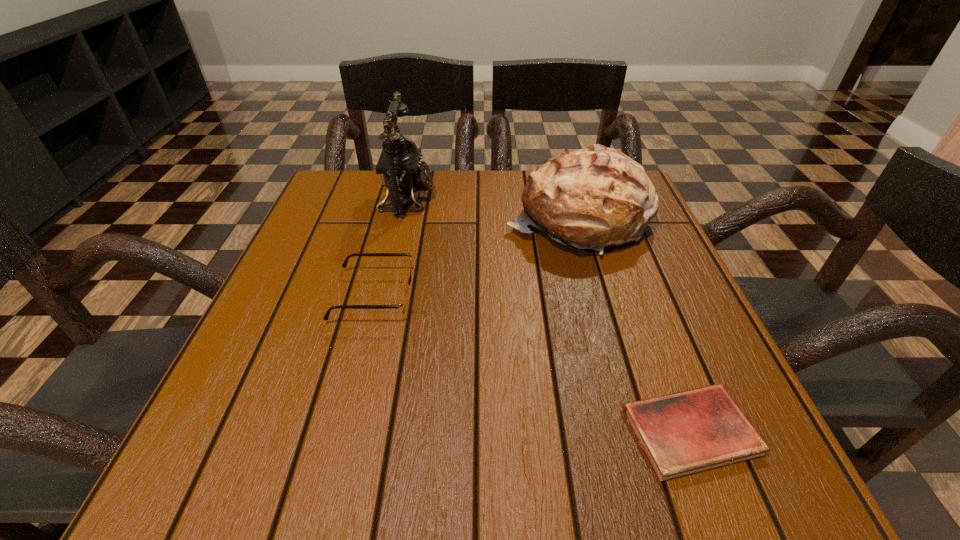
Where is `vacant space that satisfies the following two spatial constraints: 1. on the back side of the nearest object; 2. on the rotary dial of the telephone`? The width and height of the screenshot is (960, 540). vacant space that satisfies the following two spatial constraints: 1. on the back side of the nearest object; 2. on the rotary dial of the telephone is located at coordinates (602, 199).

I want to click on free location that satisfies the following two spatial constraints: 1. at the hinge ends of the third tallest object; 2. on the left side of the nearest object, so click(340, 431).

Locate an element on the screen. The width and height of the screenshot is (960, 540). free space that satisfies the following two spatial constraints: 1. at the hinge ends of the nearest object; 2. on the left side of the third tallest object is located at coordinates (340, 431).

In order to click on vacant space that satisfies the following two spatial constraints: 1. on the rotary dial of the shortest object; 2. on the right side of the telephone in this screenshot , I will do `click(355, 431)`.

Where is `vacant area in the image that satisfies the following two spatial constraints: 1. at the hinge ends of the nearest object; 2. on the left side of the spectacles`? vacant area in the image that satisfies the following two spatial constraints: 1. at the hinge ends of the nearest object; 2. on the left side of the spectacles is located at coordinates (340, 431).

Locate an element on the screen. This screenshot has height=540, width=960. vacant space that satisfies the following two spatial constraints: 1. at the hinge ends of the spectacles; 2. on the back side of the nearest object is located at coordinates (340, 431).

What are the coordinates of `free space that satisfies the following two spatial constraints: 1. on the rotary dial of the telephone; 2. on the right side of the nearest object` in the screenshot? It's located at (355, 431).

The image size is (960, 540). Identify the location of free space that satisfies the following two spatial constraints: 1. on the back side of the shortest object; 2. on the rotary dial of the tallest object. (602, 199).

At what (x,y) coordinates should I click in order to perform the action: click on vacant area in the image that satisfies the following two spatial constraints: 1. at the hinge ends of the shortest object; 2. on the right side of the spectacles. Please return your answer as a coordinate pair (x, y). The width and height of the screenshot is (960, 540). Looking at the image, I should click on (340, 431).